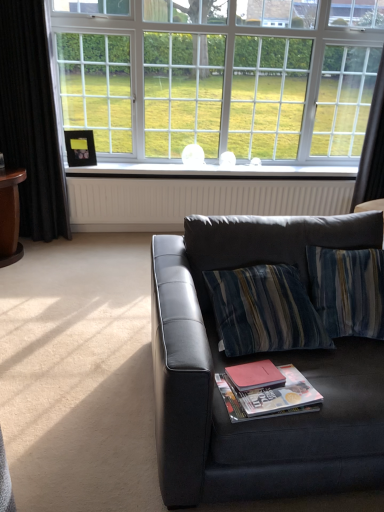
Question: Is matte black couch at center facing away from white textured radiator at center?

Choices:
 (A) yes
 (B) no

Answer: (A)

Question: Could you tell me if matte black couch at center is turned towards white textured radiator at center?

Choices:
 (A) no
 (B) yes

Answer: (A)

Question: Is matte black couch at center with white textured radiator at center?

Choices:
 (A) no
 (B) yes

Answer: (A)

Question: Does matte black couch at center have a greater height compared to white textured radiator at center?

Choices:
 (A) yes
 (B) no

Answer: (A)

Question: From a real-world perspective, is matte black couch at center positioned under white textured radiator at center based on gravity?

Choices:
 (A) yes
 (B) no

Answer: (B)

Question: Based on their positions, is white glass window at upper center located to the left or right of white textured radiator at center?

Choices:
 (A) right
 (B) left

Answer: (A)

Question: Considering the positions of point (177, 32) and point (284, 182), is point (177, 32) closer or farther from the camera than point (284, 182)?

Choices:
 (A) farther
 (B) closer

Answer: (B)

Question: From the image's perspective, is white glass window at upper center above or below white textured radiator at center?

Choices:
 (A) above
 (B) below

Answer: (A)

Question: In terms of size, does white glass window at upper center appear bigger or smaller than white textured radiator at center?

Choices:
 (A) big
 (B) small

Answer: (A)

Question: Would you say black velvet curtain at left, the first curtain in the left-to-right sequence, is inside or outside white textured radiator at center?

Choices:
 (A) inside
 (B) outside

Answer: (B)

Question: From the image's perspective, is black velvet curtain at left, the first curtain in the left-to-right sequence, positioned above or below white textured radiator at center?

Choices:
 (A) above
 (B) below

Answer: (A)

Question: Considering their positions, is black velvet curtain at left, acting as the second curtain starting from the right, located in front of or behind white textured radiator at center?

Choices:
 (A) behind
 (B) front

Answer: (B)

Question: Is black velvet curtain at left, the first curtain in the left-to-right sequence, to the left or to the right of white textured radiator at center in the image?

Choices:
 (A) left
 (B) right

Answer: (A)

Question: Is point (79, 154) closer or farther from the camera than point (3, 78)?

Choices:
 (A) closer
 (B) farther

Answer: (B)

Question: From a real-world perspective, is black matte picture frame at upper left above or below black velvet curtain at left, the first curtain in the left-to-right sequence?

Choices:
 (A) above
 (B) below

Answer: (B)